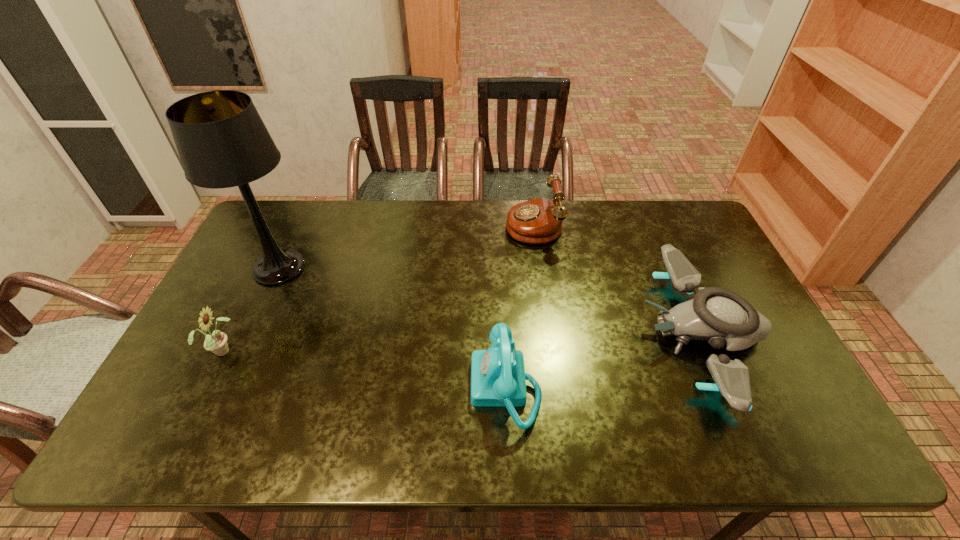
Identify which object is located as the nearest to the nearer telephone. Please provide its 2D coordinates. Your answer should be formatted as a tuple, i.e. [(x, y)], where the tuple contains the x and y coordinates of a point satisfying the conditions above.

[(719, 316)]

You are a GUI agent. You are given a task and a screenshot of the screen. Output one action in this format:
    pyautogui.click(x=<x>, y=<y>)
    Task: Click on the object that is the third closest one to the drone
    The height and width of the screenshot is (540, 960).
    Given the screenshot: What is the action you would take?
    pyautogui.click(x=222, y=142)

Locate an element on the screen. This screenshot has width=960, height=540. vacant space that satisfies the following two spatial constraints: 1. on the dial of the taller telephone; 2. on the front side of the tallest object is located at coordinates (540, 268).

Locate an element on the screen. blank area in the image that satisfies the following two spatial constraints: 1. on the front side of the table lamp; 2. on the front-facing side of the sunflower is located at coordinates (241, 350).